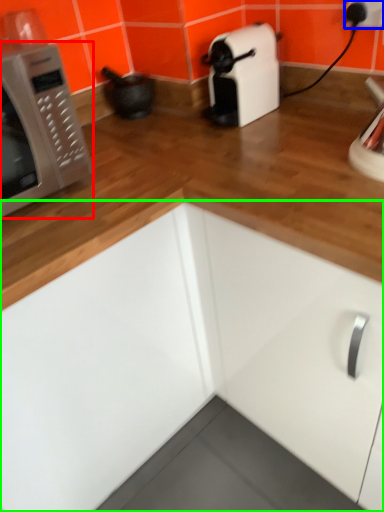
Question: Based on their relative distances, which object is nearer to microwave oven (highlighted by a red box)? Choose from electric outlet (highlighted by a blue box) and cabinetry (highlighted by a green box).

Choices:
 (A) electric outlet
 (B) cabinetry

Answer: (B)